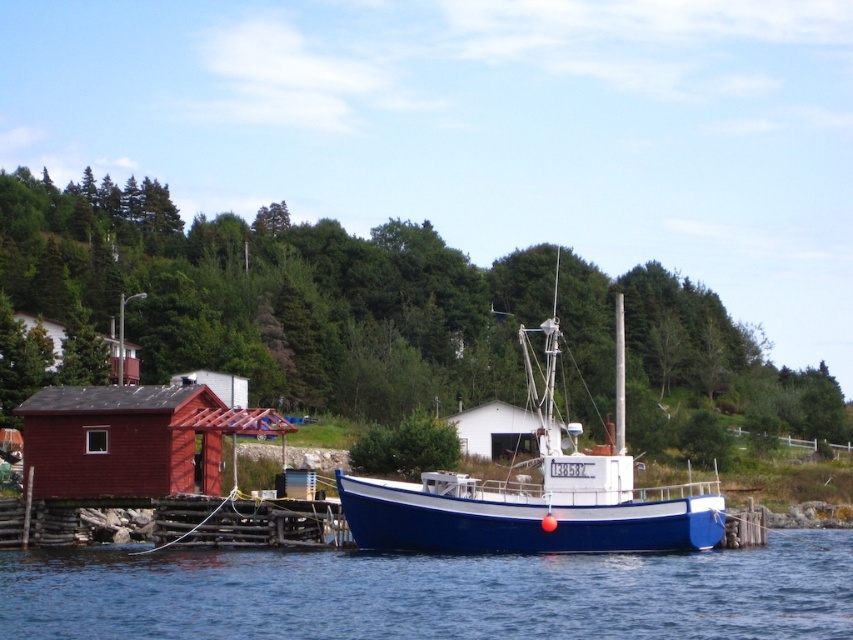
You are standing on the wooden pier and want to take a photo of the blue water at center and the white matte hut at center. Which object should you focus on first to ensure both are in the frame?

You should focus on the white matte hut at center first because the blue water at center is in front of it, so adjusting the camera to include the hut will naturally include the water as well.